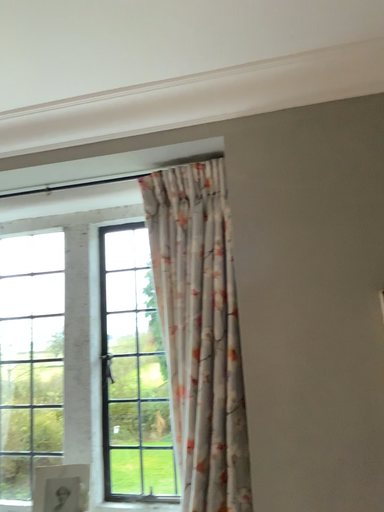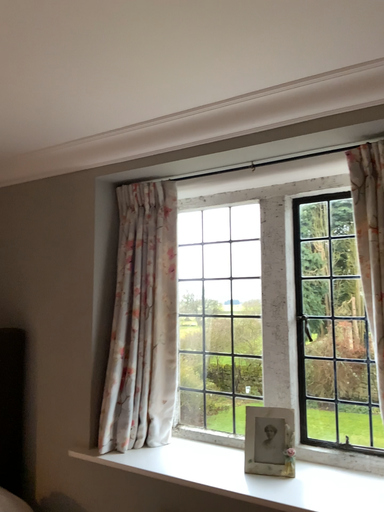
Question: Which way did the camera rotate in the video?

Choices:
 (A) rotated left
 (B) rotated right

Answer: (A)